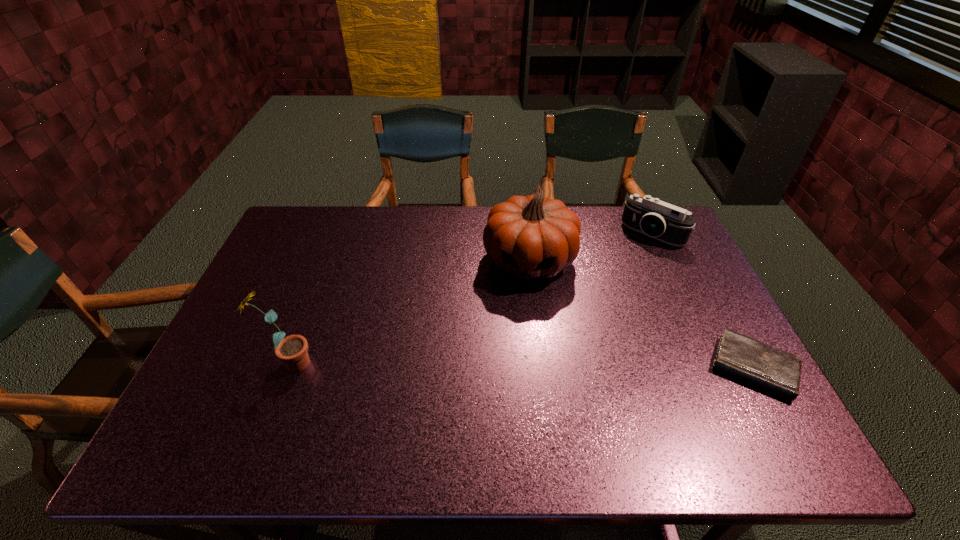
I want to click on vacant region between the third object from right to left and the diary, so click(641, 314).

Find the location of a particular element. This screenshot has width=960, height=540. vacant area that lies between the leftmost object and the camera is located at coordinates (470, 299).

I want to click on free area in between the camera and the pumpkin, so click(x=590, y=247).

Where is `empty location between the second shortest object and the third object from right to left`? empty location between the second shortest object and the third object from right to left is located at coordinates (590, 247).

The image size is (960, 540). What are the coordinates of `empty space that is in between the shortest object and the leftmost object` in the screenshot? It's located at (521, 366).

Identify which object is the nearest to the sunflower. Please provide its 2D coordinates. Your answer should be formatted as a tuple, i.e. [(x, y)], where the tuple contains the x and y coordinates of a point satisfying the conditions above.

[(532, 236)]

Find the location of a particular element. object identified as the third closest to the pumpkin is located at coordinates (292, 350).

The width and height of the screenshot is (960, 540). In order to click on blank area in the image that satisfies the following two spatial constraints: 1. on the front side of the diary; 2. on the left side of the second shortest object in this screenshot , I will do `click(714, 368)`.

The image size is (960, 540). I want to click on free location that satisfies the following two spatial constraints: 1. on the back side of the pumpkin; 2. on the left side of the camera, so click(526, 234).